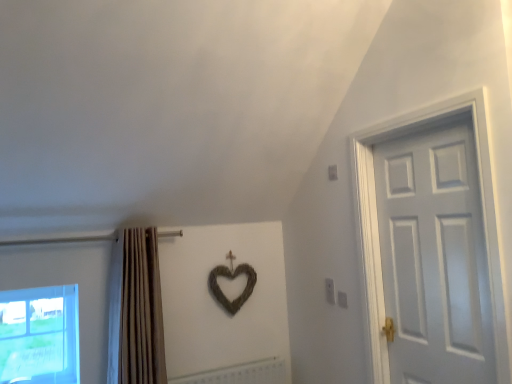
Question: Is white matte door at right to the right of transparent glass window at lower left from the viewer's perspective?

Choices:
 (A) no
 (B) yes

Answer: (B)

Question: Is transparent glass window at lower left completely or partially inside white matte door at right?

Choices:
 (A) no
 (B) yes

Answer: (A)

Question: Can you confirm if white matte door at right is positioned to the left of transparent glass window at lower left?

Choices:
 (A) no
 (B) yes

Answer: (A)

Question: From the image's perspective, is white matte door at right below transparent glass window at lower left?

Choices:
 (A) no
 (B) yes

Answer: (A)

Question: Would you consider white matte door at right to be distant from transparent glass window at lower left?

Choices:
 (A) yes
 (B) no

Answer: (A)

Question: Is white matte door at right looking in the opposite direction of transparent glass window at lower left?

Choices:
 (A) no
 (B) yes

Answer: (A)

Question: From the image's perspective, would you say beige fabric curtain at left is positioned over transparent glass window at lower left?

Choices:
 (A) no
 (B) yes

Answer: (B)

Question: Can you confirm if beige fabric curtain at left is smaller than transparent glass window at lower left?

Choices:
 (A) yes
 (B) no

Answer: (B)

Question: Is beige fabric curtain at left turned away from transparent glass window at lower left?

Choices:
 (A) no
 (B) yes

Answer: (A)

Question: Does beige fabric curtain at left lie behind transparent glass window at lower left?

Choices:
 (A) yes
 (B) no

Answer: (B)

Question: Is beige fabric curtain at left positioned far away from transparent glass window at lower left?

Choices:
 (A) no
 (B) yes

Answer: (A)

Question: Does beige fabric curtain at left lie in front of transparent glass window at lower left?

Choices:
 (A) yes
 (B) no

Answer: (A)

Question: Does white matte door at right have a greater width compared to beige fabric curtain at left?

Choices:
 (A) no
 (B) yes

Answer: (A)